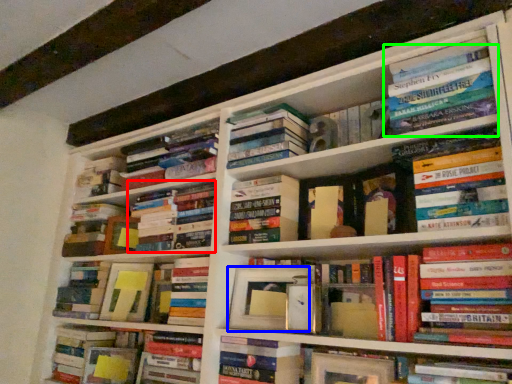
Question: Considering the real-world distances, which object is farthest from book (highlighted by a red box)? paperback book (highlighted by a blue box) or book (highlighted by a green box)?

Choices:
 (A) paperback book
 (B) book

Answer: (B)